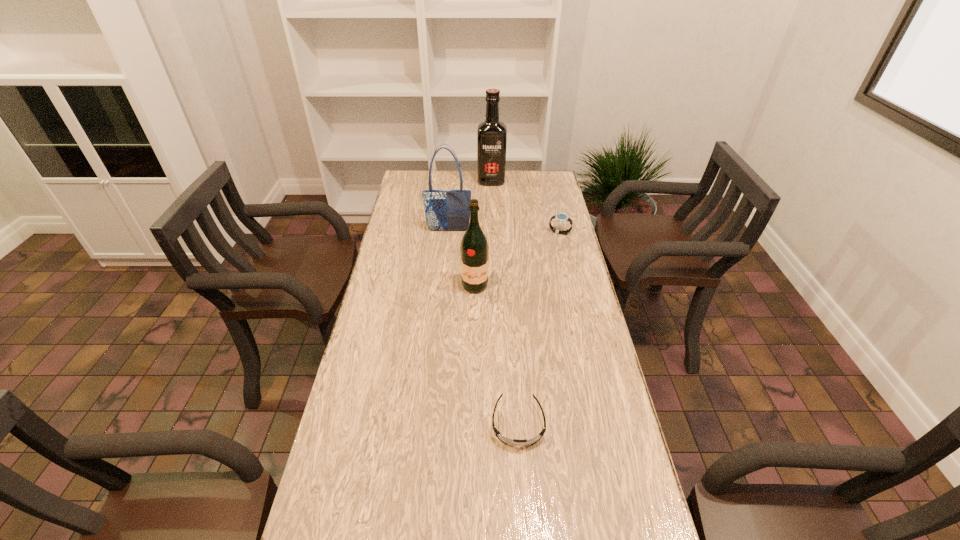
I want to click on vacant area situated on the front-facing side of the shopping bag, so click(442, 299).

At what (x,y) coordinates should I click in order to perform the action: click on vacant space located on the front-facing side of the nearer liquor. Please return your answer as a coordinate pair (x, y). The width and height of the screenshot is (960, 540). Looking at the image, I should click on (474, 323).

Identify the location of blank area located on the front of the rightmost object. (567, 265).

In order to click on vacant space located 0.130m on the lenses of the sunglasses in this screenshot , I will do `click(524, 507)`.

Locate an element on the screen. This screenshot has width=960, height=540. object that is at the far edge is located at coordinates (492, 134).

Locate an element on the screen. The height and width of the screenshot is (540, 960). object located in the left edge section of the desktop is located at coordinates (445, 210).

Where is `object at the right edge`? This screenshot has height=540, width=960. object at the right edge is located at coordinates (561, 218).

Where is `vacant space at the far edge`? vacant space at the far edge is located at coordinates (511, 181).

The height and width of the screenshot is (540, 960). In order to click on vacant space at the left edge of the desktop in this screenshot , I will do `click(420, 292)`.

Locate an element on the screen. free point at the right edge is located at coordinates (603, 521).